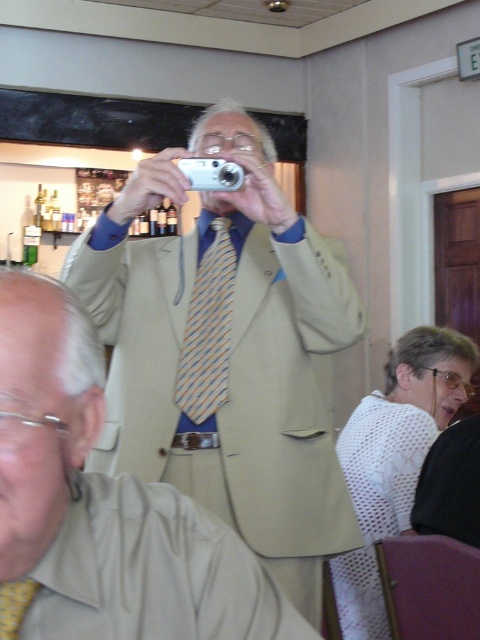
You are a photographer at the event. You want to ensure both the beige fabric suit at center and the yellow striped tie at center are clearly visible in your photo. Which one should you focus on to make sure it stands out more due to its size?

The beige fabric suit at center has a larger size compared to the yellow striped tie at center, so focusing on the beige fabric suit at center will make it stand out more due to its size.

You are taking a photo of two points in the scene described. The first point is labeled as point (x=183, y=348) and the second is point (x=1, y=592). Which point will appear closer to the camera in the final photo?

Point (x=183, y=348) is further to the camera than point (x=1, y=592), so it will appear closer in the photo.